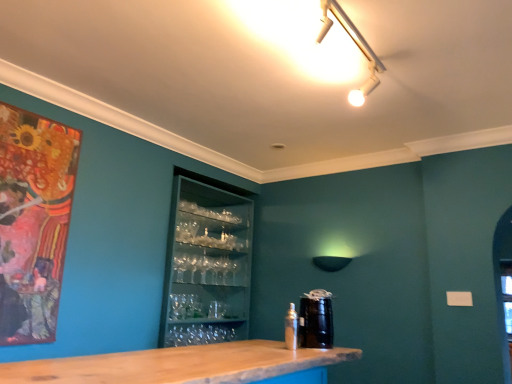
Question: Is metallic silver spray can at lower center to the left or to the right of transparent glassware at center in the image?

Choices:
 (A) right
 (B) left

Answer: (A)

Question: Considering the positions of metallic silver spray can at lower center and transparent glassware at center in the image, is metallic silver spray can at lower center bigger or smaller than transparent glassware at center?

Choices:
 (A) small
 (B) big

Answer: (A)

Question: Which of these objects is positioned farthest from the matte black lampshade at center?

Choices:
 (A) metallic silver spray can at lower center
 (B) matte wooden picture frame at left
 (C) transparent glassware at center
 (D) black glossy canister at center

Answer: (B)

Question: Which of these objects is positioned closest to the transparent glassware at center?

Choices:
 (A) matte black lampshade at center
 (B) metallic silver spray can at lower center
 (C) black glossy canister at center
 (D) matte wooden picture frame at left

Answer: (A)